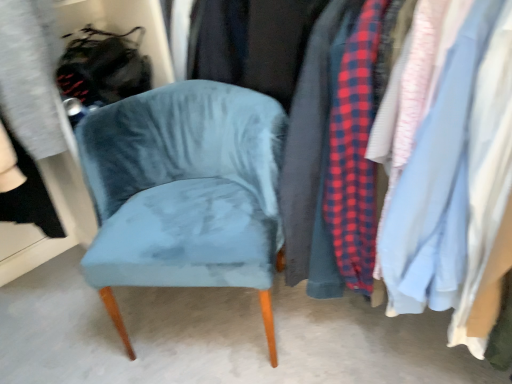
What is the approximate height of velvet blue chair at center?

It is 27.02 inches.

Measure the distance between point (175, 156) and camera.

The distance of point (175, 156) from camera is 4.08 feet.

The width and height of the screenshot is (512, 384). What do you see at coordinates (185, 191) in the screenshot?
I see `velvet blue chair at center` at bounding box center [185, 191].

Identify the location of velvet blue chair at center. Image resolution: width=512 pixels, height=384 pixels. (185, 191).

Identify the location of velvet blue chair at center. The height and width of the screenshot is (384, 512). (185, 191).